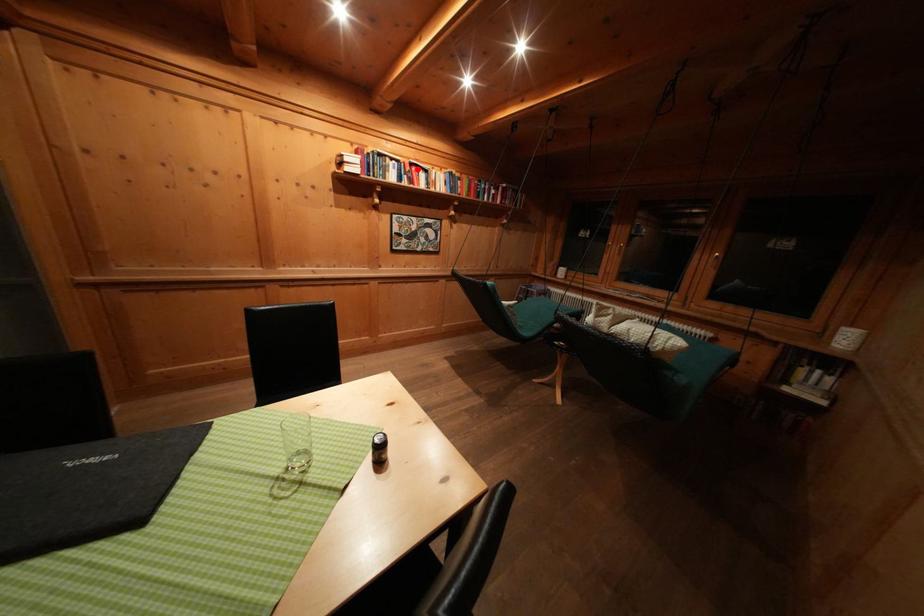
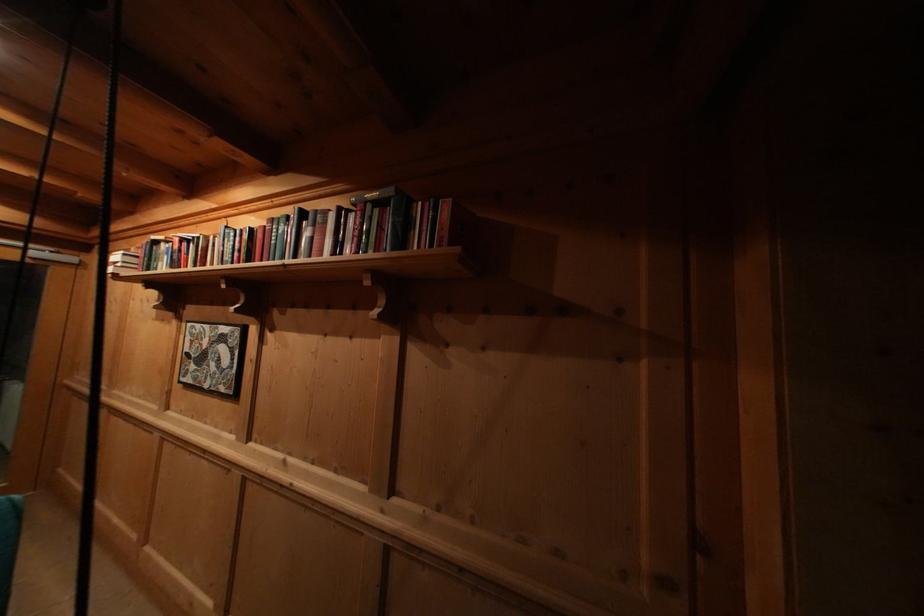
In the second image, find the point that corresponds to the highlighted location in the first image.

(188, 246)